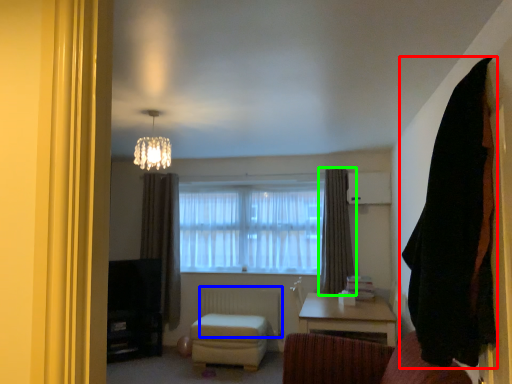
Question: Which object is positioned closest to curtain (highlighted by a red box)? Select from radiator (highlighted by a blue box) and curtain (highlighted by a green box).

Choices:
 (A) radiator
 (B) curtain

Answer: (B)